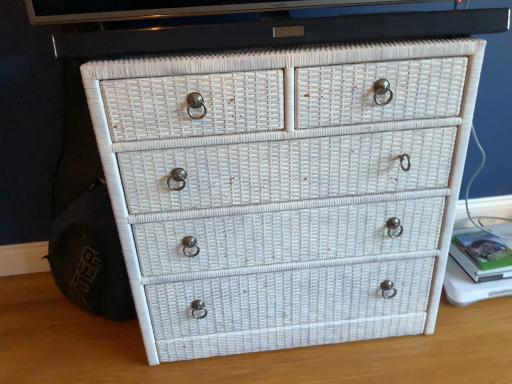
Question: Is white wicker chest of drawers at center aimed at green matte book at right?

Choices:
 (A) no
 (B) yes

Answer: (A)

Question: From the image's perspective, is white wicker chest of drawers at center over green matte book at right?

Choices:
 (A) no
 (B) yes

Answer: (B)

Question: Is white wicker chest of drawers at center wider than green matte book at right?

Choices:
 (A) no
 (B) yes

Answer: (B)

Question: Is white wicker chest of drawers at center not close to green matte book at right?

Choices:
 (A) yes
 (B) no

Answer: (B)

Question: Is white wicker chest of drawers at center to the right of green matte book at right from the viewer's perspective?

Choices:
 (A) no
 (B) yes

Answer: (A)

Question: Is white wicker chest of drawers at center looking in the opposite direction of green matte book at right?

Choices:
 (A) yes
 (B) no

Answer: (B)

Question: From a real-world perspective, is green matte book at right located beneath white wicker chest of drawers at center?

Choices:
 (A) yes
 (B) no

Answer: (A)

Question: Does green matte book at right have a larger size compared to white wicker chest of drawers at center?

Choices:
 (A) yes
 (B) no

Answer: (B)

Question: Is green matte book at right aimed at white wicker chest of drawers at center?

Choices:
 (A) no
 (B) yes

Answer: (A)

Question: Does green matte book at right appear on the left side of white wicker chest of drawers at center?

Choices:
 (A) yes
 (B) no

Answer: (B)

Question: Is white wicker chest of drawers at center completely or partially inside green matte book at right?

Choices:
 (A) no
 (B) yes

Answer: (A)

Question: Is green matte book at right wider than white wicker chest of drawers at center?

Choices:
 (A) yes
 (B) no

Answer: (B)

Question: Can we say white wicker drawer at center lies outside green matte book at right?

Choices:
 (A) no
 (B) yes

Answer: (B)